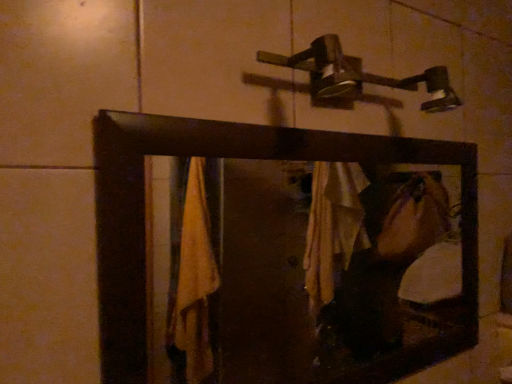
This screenshot has width=512, height=384. I want to click on metallic silver shower at upper center, so click(x=359, y=75).

What do you see at coordinates (359, 75) in the screenshot?
I see `metallic silver shower at upper center` at bounding box center [359, 75].

Identify the location of wooden frame mirror at center. [308, 271].

Describe the element at coordinates (308, 271) in the screenshot. I see `wooden frame mirror at center` at that location.

Find the location of `metallic silver shower at upper center`. metallic silver shower at upper center is located at coordinates (359, 75).

Visually, is wooden frame mirror at center positioned to the left or to the right of metallic silver shower at upper center?

Based on their positions, wooden frame mirror at center is located to the left of metallic silver shower at upper center.

Which object is closer to the camera taking this photo, wooden frame mirror at center or metallic silver shower at upper center?

wooden frame mirror at center is closer to the camera.

Which is closer to the camera, (328, 288) or (399, 80)?

Point (328, 288) is farther from the camera than point (399, 80).

From the image's perspective, relative to metallic silver shower at upper center, is wooden frame mirror at center above or below?

wooden frame mirror at center is below metallic silver shower at upper center.

From a real-world perspective, does wooden frame mirror at center sit lower than metallic silver shower at upper center?

Indeed, from a real-world perspective, wooden frame mirror at center is positioned beneath metallic silver shower at upper center.

Can you confirm if wooden frame mirror at center is wider than metallic silver shower at upper center?

No, wooden frame mirror at center is not wider than metallic silver shower at upper center.

In the scene shown: Between wooden frame mirror at center and metallic silver shower at upper center, which one has more height?

Standing taller between the two is wooden frame mirror at center.

Looking at the image, does wooden frame mirror at center seem bigger or smaller compared to metallic silver shower at upper center?

Considering their sizes, wooden frame mirror at center takes up more space than metallic silver shower at upper center.

Is metallic silver shower at upper center completely or partially inside wooden frame mirror at center?

That's incorrect, metallic silver shower at upper center is not inside wooden frame mirror at center.

Is wooden frame mirror at center in contact with metallic silver shower at upper center?

No.

Consider the image. Could you tell me if wooden frame mirror at center is facing metallic silver shower at upper center?

No, wooden frame mirror at center is not facing towards metallic silver shower at upper center.

The height and width of the screenshot is (384, 512). Find the location of `shower that appears behind the wooden frame mirror at center`. shower that appears behind the wooden frame mirror at center is located at coordinates (359, 75).

Considering the positions of objects metallic silver shower at upper center and wooden frame mirror at center in the image provided, who is more to the left, metallic silver shower at upper center or wooden frame mirror at center?

wooden frame mirror at center.

Which object is further away from the camera, metallic silver shower at upper center or wooden frame mirror at center?

metallic silver shower at upper center is further from the camera.

Does point (298, 53) appear closer or farther from the camera than point (338, 235)?

Point (298, 53) appears to be closer to the viewer than point (338, 235).

From the image's perspective, between metallic silver shower at upper center and wooden frame mirror at center, which one is located above?

metallic silver shower at upper center appears higher in the image.

From a real-world perspective, is metallic silver shower at upper center positioned over wooden frame mirror at center based on gravity?

Correct, in the physical world, metallic silver shower at upper center is higher than wooden frame mirror at center.

Does metallic silver shower at upper center have a greater width compared to wooden frame mirror at center?

Correct, the width of metallic silver shower at upper center exceeds that of wooden frame mirror at center.

Who is taller, metallic silver shower at upper center or wooden frame mirror at center?

With more height is wooden frame mirror at center.

Which of these two, metallic silver shower at upper center or wooden frame mirror at center, is bigger?

wooden frame mirror at center is bigger.

Is metallic silver shower at upper center spatially inside wooden frame mirror at center, or outside of it?

metallic silver shower at upper center is spatially situated outside wooden frame mirror at center.

Does metallic silver shower at upper center touch wooden frame mirror at center?

metallic silver shower at upper center and wooden frame mirror at center are clearly separated.

Is metallic silver shower at upper center looking in the opposite direction of wooden frame mirror at center?

No, metallic silver shower at upper center's orientation is not away from wooden frame mirror at center.

Can you tell me how much metallic silver shower at upper center and wooden frame mirror at center differ in facing direction?

The angle between the facing direction of metallic silver shower at upper center and the facing direction of wooden frame mirror at center is 0.0981 degrees.

Where is `shower above the wooden frame mirror at center (from the image's perspective)`? The image size is (512, 384). shower above the wooden frame mirror at center (from the image's perspective) is located at coordinates (359, 75).

Find the location of a particular element. mirror below the metallic silver shower at upper center (from the image's perspective) is located at coordinates (308, 271).

Locate an element on the screen. shower behind the wooden frame mirror at center is located at coordinates pos(359,75).